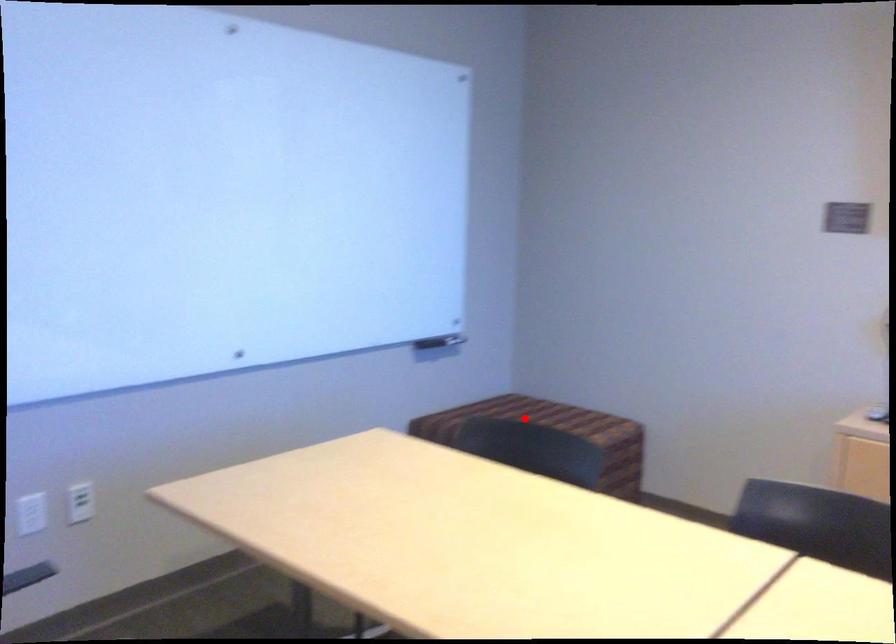
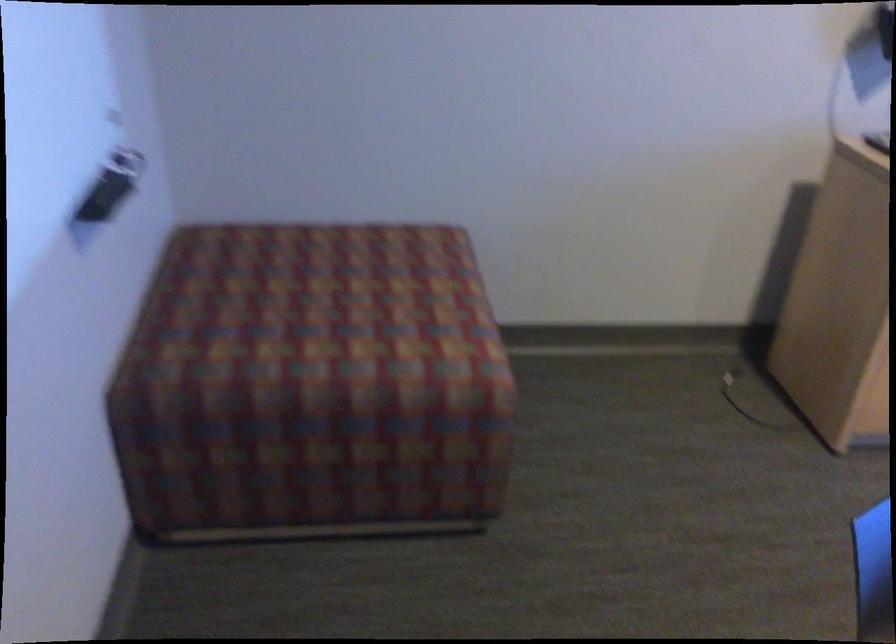
Find the pixel in the second image that matches the highlighted location in the first image.

(332, 301)